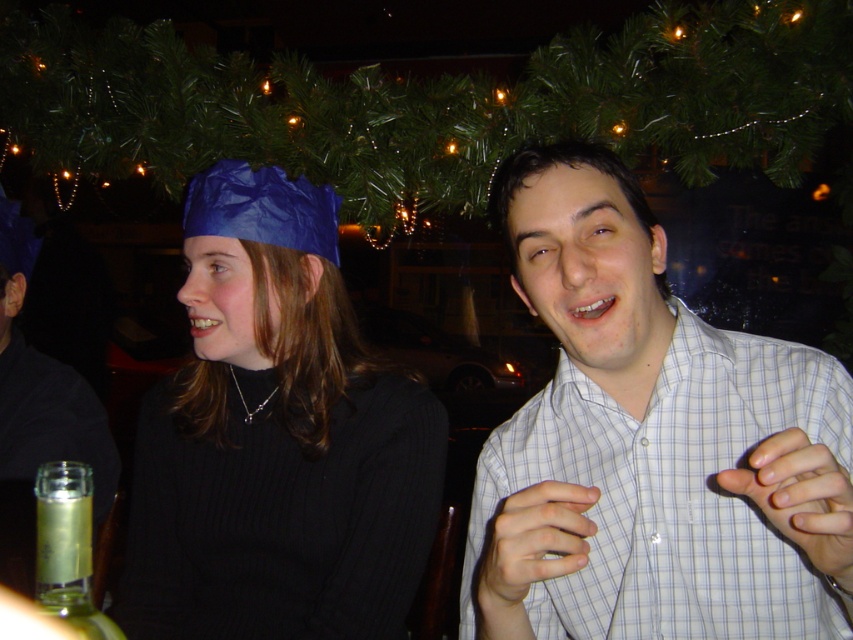
Question: Which object is positioned farthest from the white checkered shirt at center?

Choices:
 (A) matte blue paper hat at upper left
 (B) clear glass bottle at lower left

Answer: (B)

Question: Among these points, which one is farthest from the camera?

Choices:
 (A) (286, 294)
 (B) (0, 273)
 (C) (38, 522)
 (D) (497, 492)

Answer: (B)

Question: Can you confirm if matte blue paper hat at upper left is bigger than clear glass bottle at lower left?

Choices:
 (A) yes
 (B) no

Answer: (A)

Question: Does white checkered shirt at center come behind clear glass bottle at lower left?

Choices:
 (A) no
 (B) yes

Answer: (A)

Question: Among these points, which one is farthest from the camera?

Choices:
 (A) (90, 508)
 (B) (193, 577)
 (C) (680, 397)

Answer: (B)

Question: Is white checkered shirt at center closer to the viewer compared to matte black shirt at center?

Choices:
 (A) yes
 (B) no

Answer: (A)